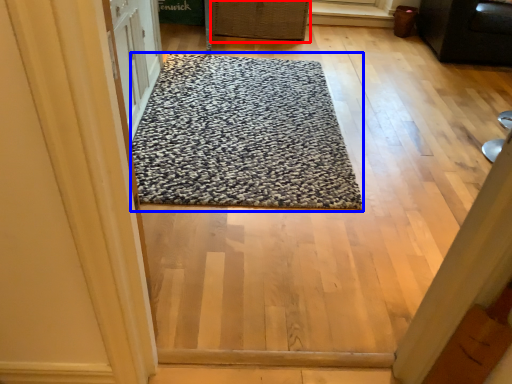
Question: Among these objects, which one is nearest to the camera, basket (highlighted by a red box) or mat (highlighted by a blue box)?

Choices:
 (A) basket
 (B) mat

Answer: (B)